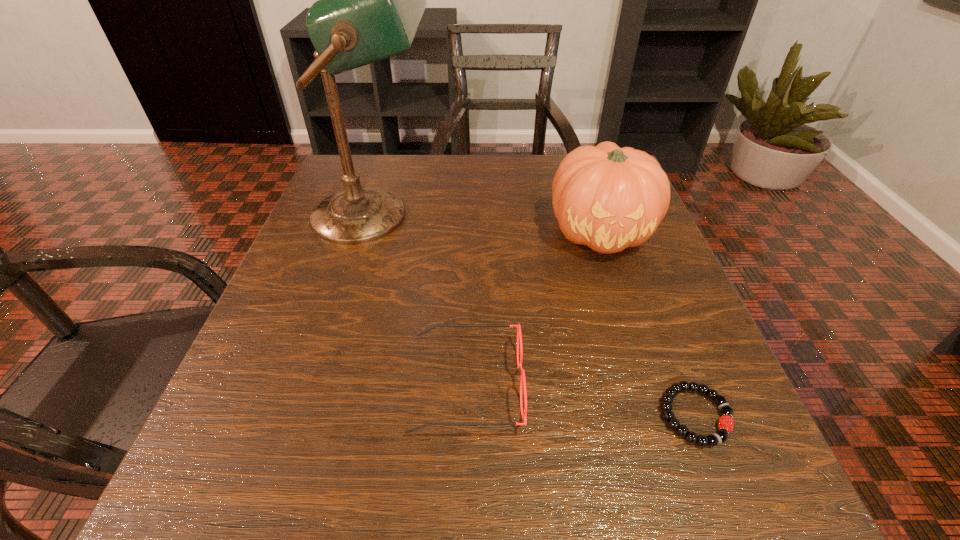
You are a GUI agent. You are given a task and a screenshot of the screen. Output one action in this format:
    pyautogui.click(x=<x>, y=<y>)
    Task: Click on the blank area at the near right corner
    The height and width of the screenshot is (540, 960).
    Given the screenshot: What is the action you would take?
    pyautogui.click(x=695, y=505)

Where is `free area in between the pumpkin and the spectacles`? Image resolution: width=960 pixels, height=540 pixels. free area in between the pumpkin and the spectacles is located at coordinates (534, 308).

Identify the location of vacant area between the third shortest object and the table lamp. tap(488, 224).

Where is `vacant area that lies between the pumpkin and the table lamp`? This screenshot has width=960, height=540. vacant area that lies between the pumpkin and the table lamp is located at coordinates (488, 224).

The width and height of the screenshot is (960, 540). What are the coordinates of `vacant space that's between the table lamp and the second shortest object` in the screenshot? It's located at 420,300.

Identify the location of empty space that is in between the second tallest object and the tallest object. (488, 224).

The image size is (960, 540). Identify the location of vacant space in between the tallest object and the second shortest object. (420, 300).

Find the location of `empty space that is in between the table lamp and the bracelet`. empty space that is in between the table lamp and the bracelet is located at coordinates (535, 315).

Identify the location of free space between the shortest object and the second shortest object. (581, 400).

At what (x,y) coordinates should I click in order to perform the action: click on unoccupied area between the pumpkin and the spectacles. Please return your answer as a coordinate pair (x, y). This screenshot has height=540, width=960. Looking at the image, I should click on (534, 308).